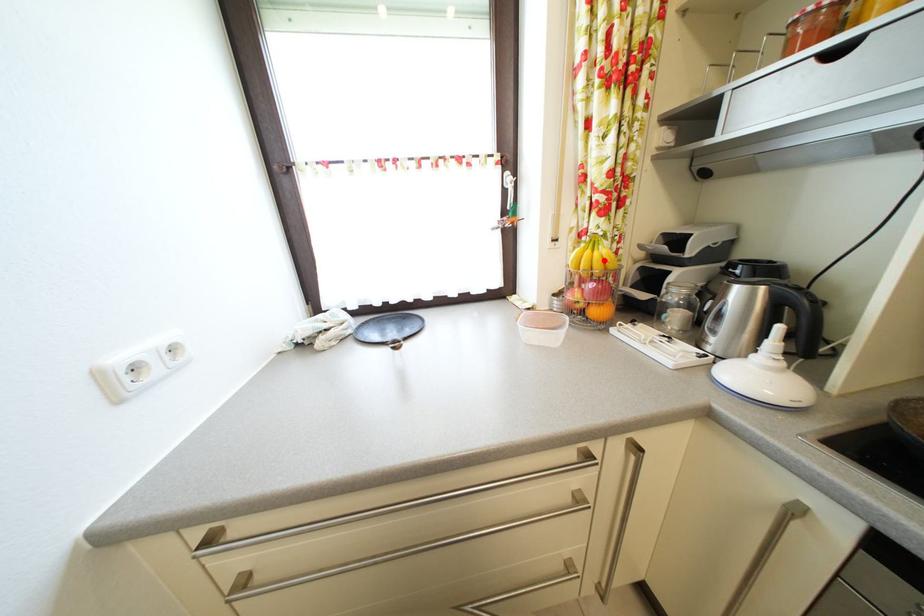
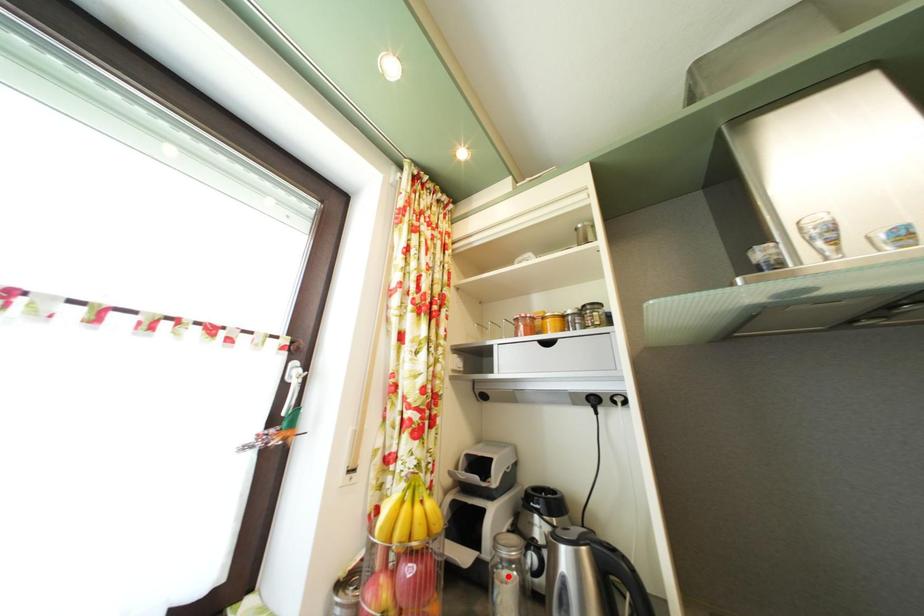
I am providing you with two images of the same scene from different viewpoints. A red point is marked on the first image and another point is marked on the second image. Does the point marked in image1 correspond to the same location as the one in image2?

No